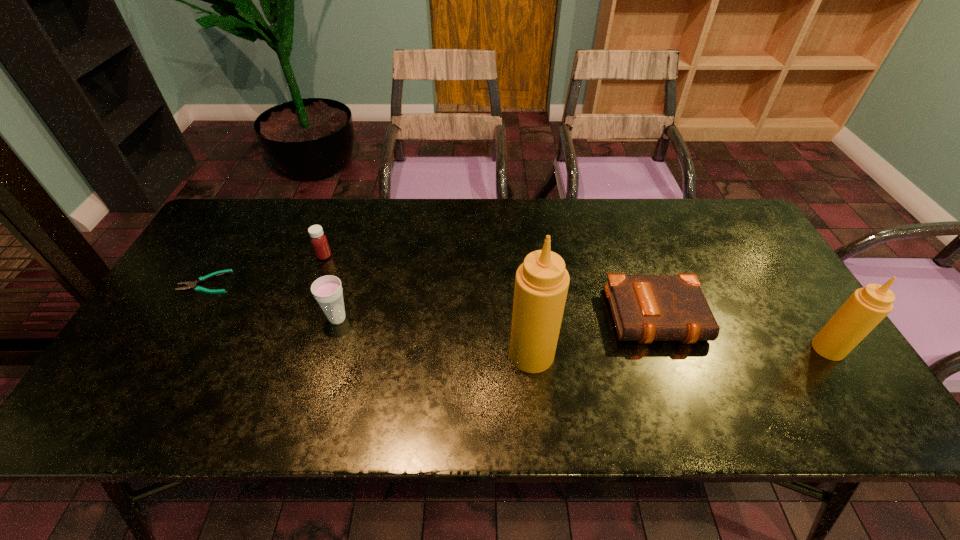
This screenshot has height=540, width=960. I want to click on the leftmost object, so click(191, 284).

This screenshot has width=960, height=540. I want to click on the shortest object, so click(x=191, y=284).

This screenshot has width=960, height=540. I want to click on free space located on the back of the taller condiment, so click(x=520, y=241).

You are a GUI agent. You are given a task and a screenshot of the screen. Output one action in this format:
    pyautogui.click(x=<x>, y=<y>)
    Task: Click on the vacant space located 0.400m on the left of the right condiment
    The height and width of the screenshot is (540, 960).
    Given the screenshot: What is the action you would take?
    pyautogui.click(x=650, y=348)

Identify the location of free space located 0.090m on the front of the cup. (325, 360).

Image resolution: width=960 pixels, height=540 pixels. In order to click on free space located on the front of the farthest object in this screenshot , I will do `click(308, 300)`.

Where is `free space located on the right of the leftmost object`? free space located on the right of the leftmost object is located at coordinates (361, 282).

This screenshot has width=960, height=540. I want to click on object that is at the left edge, so click(x=191, y=284).

Where is `object that is at the right edge`? This screenshot has height=540, width=960. object that is at the right edge is located at coordinates (866, 307).

This screenshot has width=960, height=540. Identify the location of object positioned at the near right corner. (866, 307).